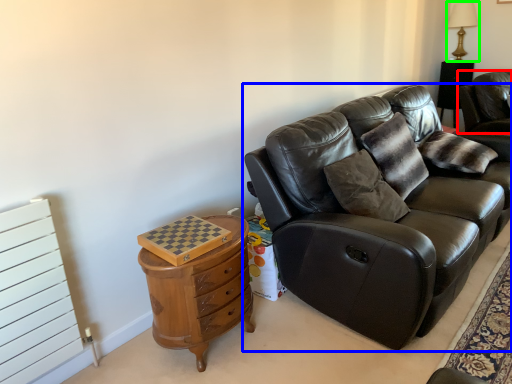
Question: Based on their relative distances, which object is farther from chair (highlighted by a red box)? Choose from studio couch (highlighted by a blue box) and table lamp (highlighted by a green box).

Choices:
 (A) studio couch
 (B) table lamp

Answer: (A)